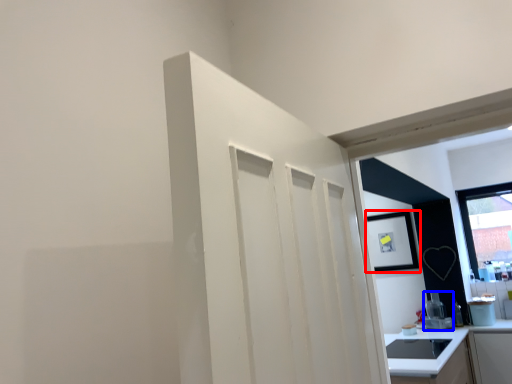
Question: Which object appears closest to the camera in this image, picture frame (highlighted by a red box) or appliance (highlighted by a blue box)?

Choices:
 (A) picture frame
 (B) appliance

Answer: (B)